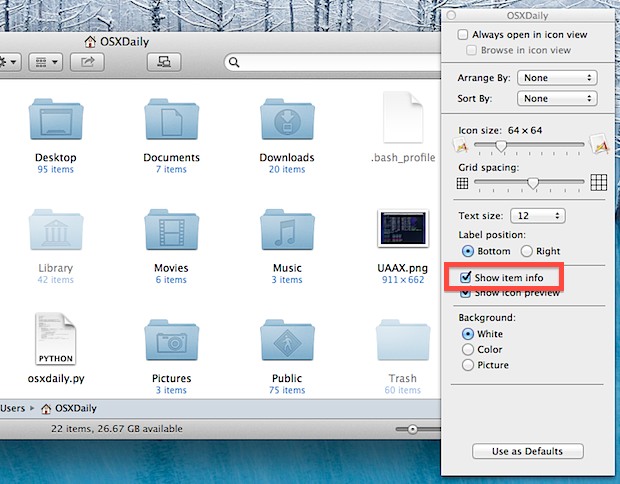
This screenshot has width=620, height=484. I want to click on folders, so click(x=50, y=132), click(x=180, y=132), click(x=317, y=132), click(x=306, y=228), click(x=180, y=240), click(x=56, y=238), click(x=178, y=347), click(x=285, y=340), click(x=414, y=339).